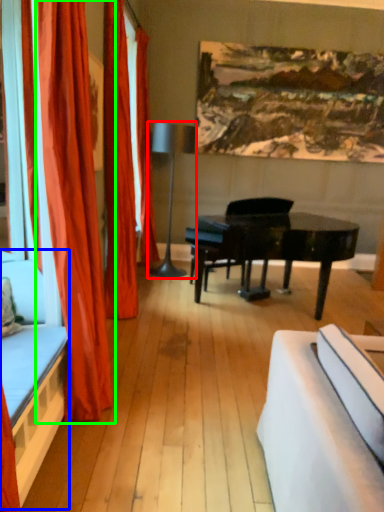
Question: Estimate the real-world distances between objects in this image. Which object is farther from lamp (highlighted by a red box), bed frame (highlighted by a blue box) or curtain (highlighted by a green box)?

Choices:
 (A) bed frame
 (B) curtain

Answer: (A)